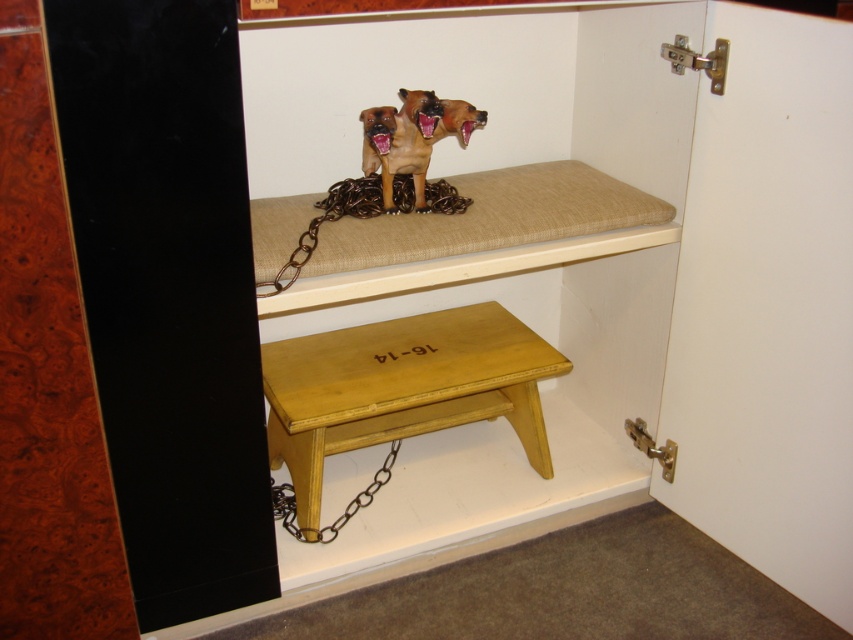
You are standing in the room and need to reach a high shelf. You see the yellow wood step stool at lower center. Where exactly is the yellow wood step stool located in the room?

The yellow wood step stool at lower center is located at point (401, 388).

You are trying to reach a book on a high shelf in the room. The yellow wood step stool at lower center and the brown metallic chain at upper center are in your way. Which object should you move first to clear the path?

You should move the yellow wood step stool at lower center first because it is located below the brown metallic chain at upper center, so moving it won t interfere with the chain.